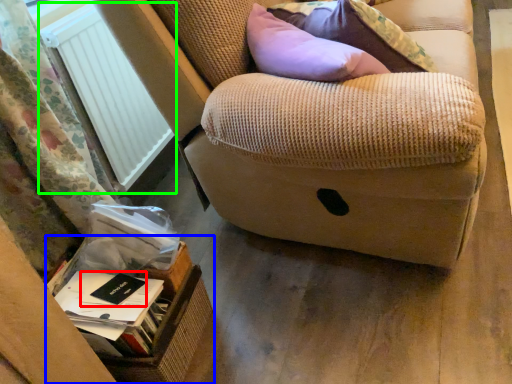
Question: Which is farther away from paperback book (highlighted by a red box)? cardboard box (highlighted by a blue box) or radiator (highlighted by a green box)?

Choices:
 (A) cardboard box
 (B) radiator

Answer: (B)